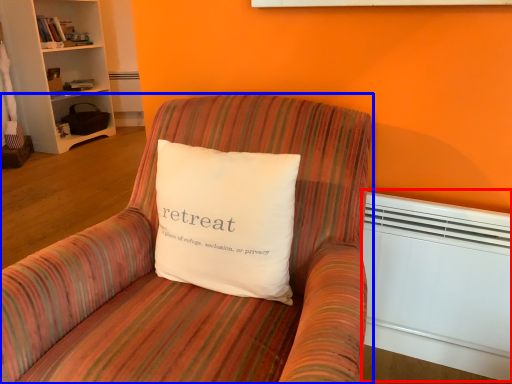
Question: Which point is closer to the camera, heater (highlighted by a red box) or chair (highlighted by a blue box)?

Choices:
 (A) heater
 (B) chair

Answer: (B)